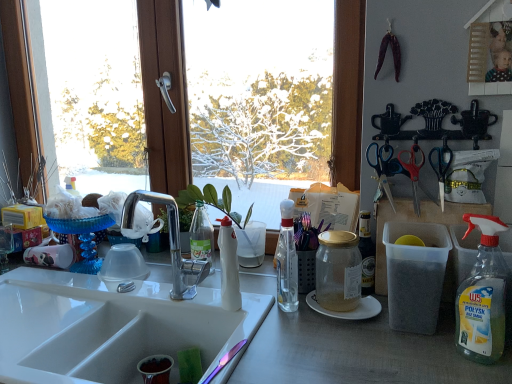
This screenshot has height=384, width=512. I want to click on free space that is in between white paper plate at center and clear plastic bottle at right, positioned as the first bottle in right-to-left order, so [x=403, y=337].